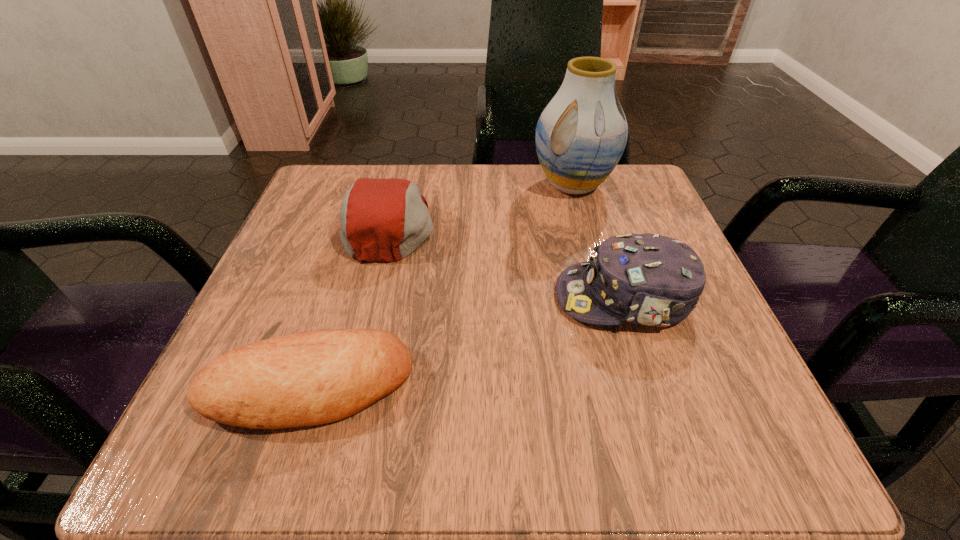
At what (x,y) coordinates should I click in order to perform the action: click on vacant area that lies between the right headwear and the left headwear. Please return your answer as a coordinate pair (x, y). The height and width of the screenshot is (540, 960). Looking at the image, I should click on (507, 262).

I want to click on free space between the left headwear and the bread, so click(349, 307).

Identify the location of blank region between the vase and the left headwear. The height and width of the screenshot is (540, 960). (481, 205).

The image size is (960, 540). In order to click on vacant area that lies between the vase and the left headwear in this screenshot , I will do `click(481, 205)`.

In order to click on vacant area that lies between the right headwear and the nearest object in this screenshot , I will do `click(467, 342)`.

What are the coordinates of `free space between the vase and the left headwear` in the screenshot? It's located at (481, 205).

Find the location of a particular element. This screenshot has width=960, height=540. unoccupied area between the shortest object and the tallest object is located at coordinates (441, 286).

Find the location of a particular element. The width and height of the screenshot is (960, 540). object that ranks as the closest to the nearest object is located at coordinates (385, 220).

Where is `the third closest object relative to the left headwear`? The width and height of the screenshot is (960, 540). the third closest object relative to the left headwear is located at coordinates click(647, 279).

I want to click on free space that satisfies the following two spatial constraints: 1. on the front-facing side of the right headwear; 2. on the front side of the shortest object, so click(x=654, y=387).